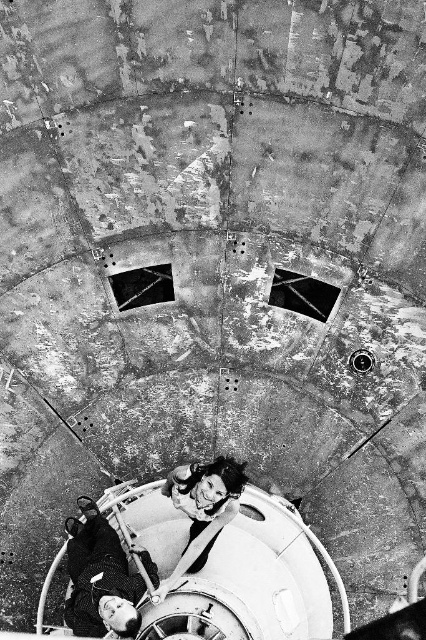
Question: Can you confirm if smooth leather jacket at lower left is positioned above smooth skin woman at center?

Choices:
 (A) no
 (B) yes

Answer: (A)

Question: Among these objects, which one is farthest from the camera?

Choices:
 (A) smooth leather jacket at lower left
 (B) smooth skin woman at center

Answer: (B)

Question: Which object appears farthest from the camera in this image?

Choices:
 (A) smooth skin woman at center
 (B) smooth leather jacket at lower left

Answer: (A)

Question: Does smooth leather jacket at lower left come behind smooth skin woman at center?

Choices:
 (A) yes
 (B) no

Answer: (B)

Question: Is smooth leather jacket at lower left behind smooth skin woman at center?

Choices:
 (A) yes
 (B) no

Answer: (B)

Question: Among these objects, which one is nearest to the camera?

Choices:
 (A) smooth skin woman at center
 (B) smooth leather jacket at lower left

Answer: (B)